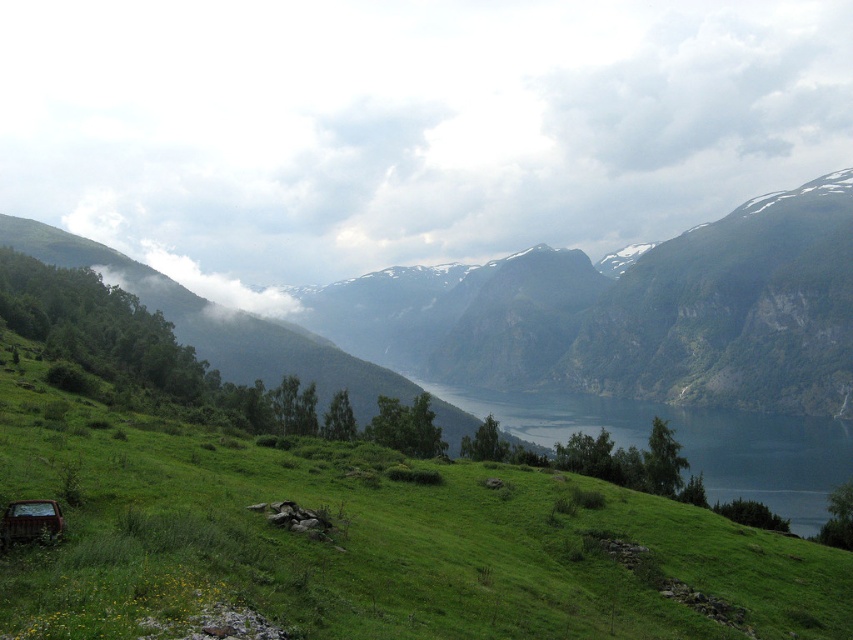
You are an airplane pilot flying over the landscape. You notice two white fluffy clouds in the sky. Which cloud is lower in the sky between the white fluffy cloud at upper center and the white fluffy cloud at upper right?

The white fluffy cloud at upper center is located below the white fluffy cloud at upper right, so it is lower in the sky.

You are a pilot flying a small airplane and you notice two clouds in the sky. One is the white fluffy cloud at upper center and the other is the white fluffy cloud at upper right. Which cloud is higher in the sky?

The white fluffy cloud at upper center is taller than the white fluffy cloud at upper right, so the white fluffy cloud at upper center is higher in the sky.

You are a drone operator flying a drone that is 2 meters tall. You want to fly your drone between the white fluffy cloud at upper center and the green grassy hillside at lower left. Can your drone fit vertically between them?

The white fluffy cloud at upper center is taller than the green grassy hillside at lower left. Since the drone is 2 meters tall, it depends on the vertical distance between them. However, the description only states their relative height, not the actual distance. Without specific measurements, we cannot confirm if the drone can fit vertically between them.